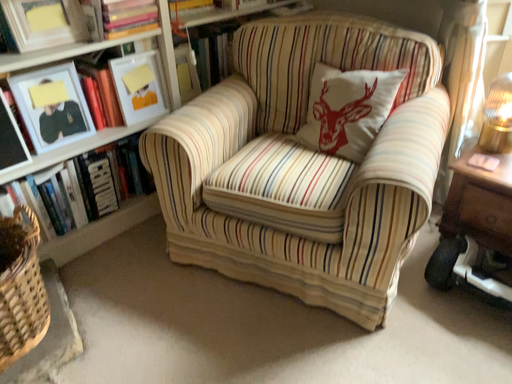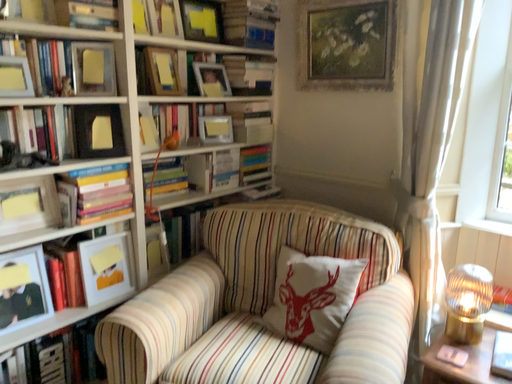
Question: Which way did the camera rotate in the video?

Choices:
 (A) rotated downward
 (B) rotated upward

Answer: (B)